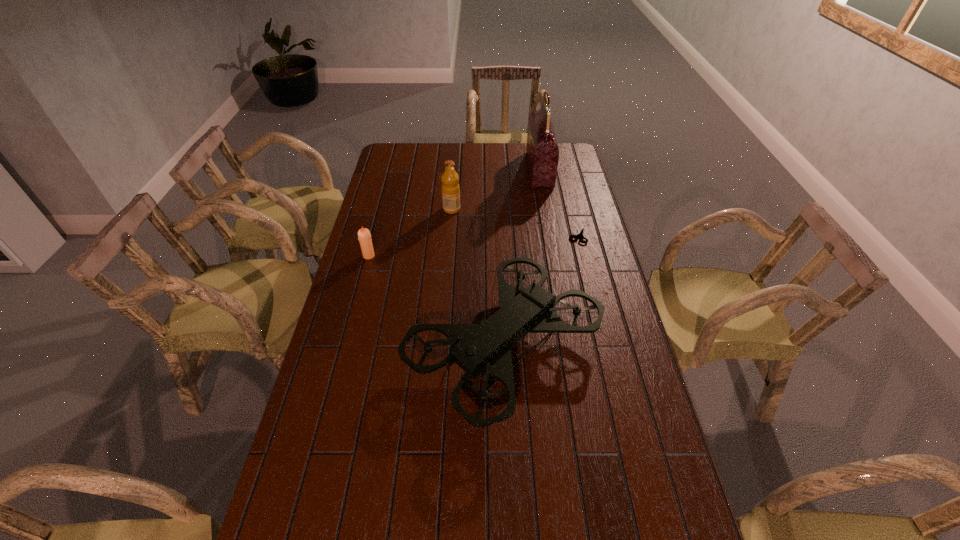
The image size is (960, 540). Find the location of `free space between the third shortest object and the tallest object`. free space between the third shortest object and the tallest object is located at coordinates (495, 190).

Identify the location of vacant space in between the candle and the drone. The width and height of the screenshot is (960, 540). (437, 301).

The width and height of the screenshot is (960, 540). What are the coordinates of `empty space that is in between the leftmost object and the nearest object` in the screenshot? It's located at (437, 301).

Locate an element on the screen. free area in between the third shortest object and the farthest object is located at coordinates (495, 190).

I want to click on free space between the shears and the handbag, so click(x=559, y=202).

The width and height of the screenshot is (960, 540). Identify the location of the fourth closest object to the drone. (542, 151).

Identify which object is the third closest to the candle. Please provide its 2D coordinates. Your answer should be formatted as a tuple, i.e. [(x, y)], where the tuple contains the x and y coordinates of a point satisfying the conditions above.

[(580, 234)]

Where is `free space that satisfies the following two spatial constraints: 1. on the back side of the fourth shortest object; 2. on the front label of the third tallest object`? free space that satisfies the following two spatial constraints: 1. on the back side of the fourth shortest object; 2. on the front label of the third tallest object is located at coordinates (497, 209).

In order to click on free spot that satisfies the following two spatial constraints: 1. on the front-facing side of the handbag; 2. on the right side of the shears in this screenshot , I will do `click(551, 236)`.

Locate an element on the screen. The height and width of the screenshot is (540, 960). vacant area that satisfies the following two spatial constraints: 1. on the back side of the fourth tallest object; 2. on the right side of the third nearest object is located at coordinates (374, 236).